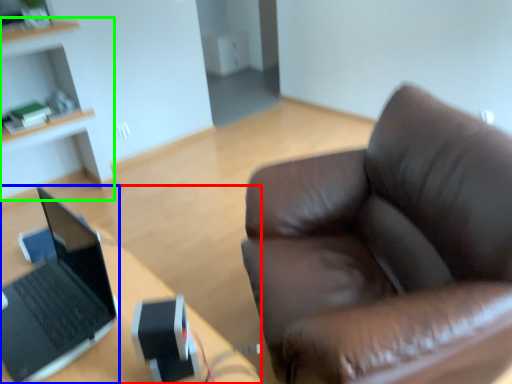
Question: Which object is positioned closest to desk (highlighted by a red box)? Select from laptop (highlighted by a blue box) and cabinetry (highlighted by a green box).

Choices:
 (A) laptop
 (B) cabinetry

Answer: (A)